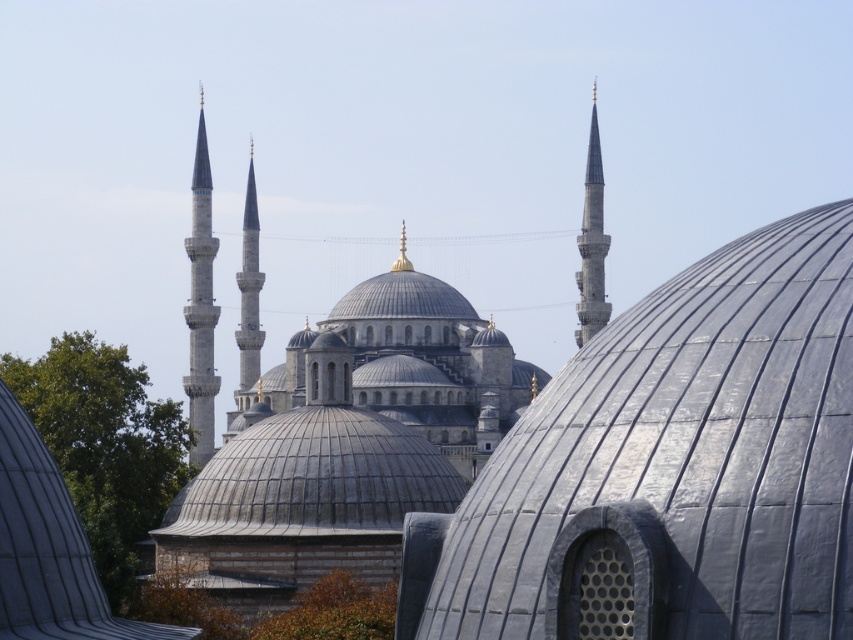
Question: Among these points, which one is farthest from the camera?

Choices:
 (A) (821, 465)
 (B) (18, 444)
 (C) (201, 152)
 (D) (602, 323)

Answer: (D)

Question: Where is gray stone dome at center located in relation to smooth silver spire at right in the image?

Choices:
 (A) below
 (B) above

Answer: (A)

Question: Can you confirm if gray stone dome at center is smaller than smooth silver spire at right?

Choices:
 (A) no
 (B) yes

Answer: (B)

Question: From the image, what is the correct spatial relationship of gray metallic dome at center in relation to smooth silver spire at right?

Choices:
 (A) right
 (B) left

Answer: (B)

Question: Which object is farther from the camera taking this photo?

Choices:
 (A) slate gray stone minaret at center
 (B) gray stone dome at center

Answer: (A)

Question: Based on their relative distances, which object is nearer to the smooth white minaret at left?

Choices:
 (A) slate gray stone minaret at center
 (B) gray metallic dome at center
 (C) gray stone dome at center
 (D) smooth silver spire at right

Answer: (D)